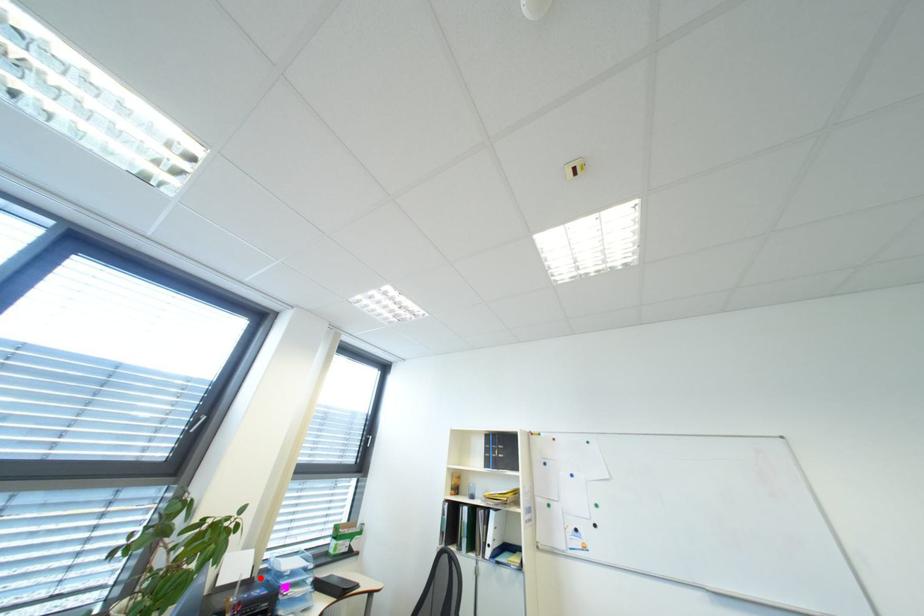
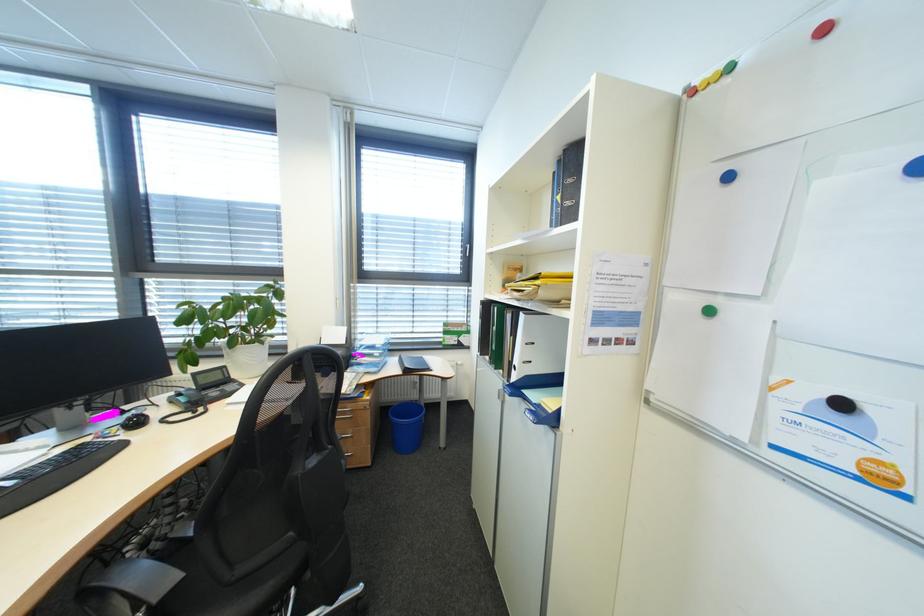
Where in the second image is the point corresponding to the highlighted location from the first image?

(355, 344)